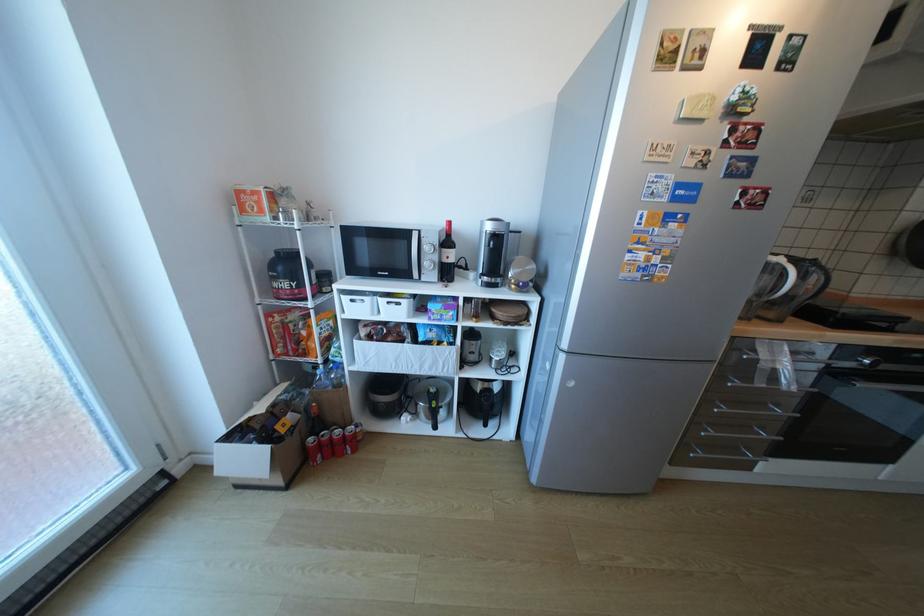
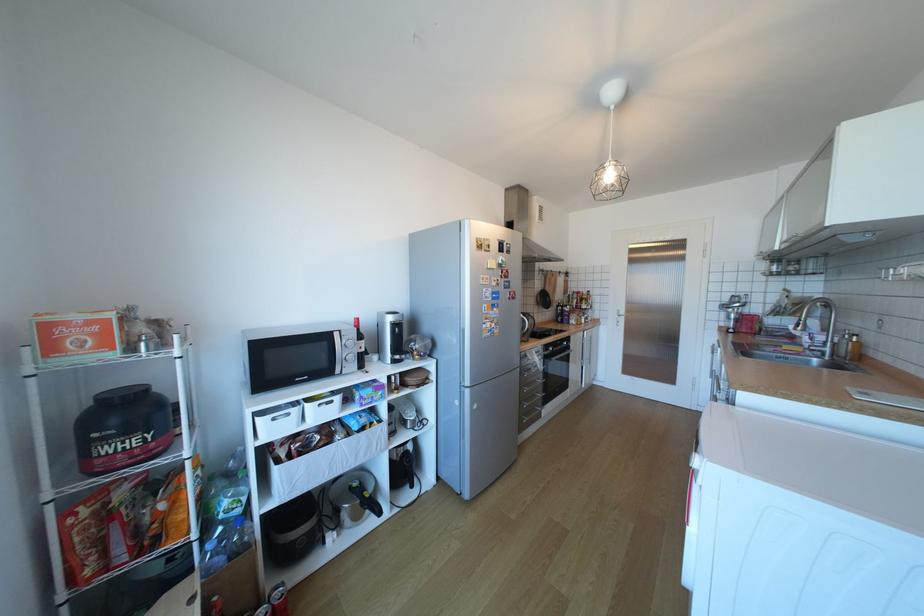
Find the pixel in the second image that matches pixel 703 424 in the first image.

(529, 403)